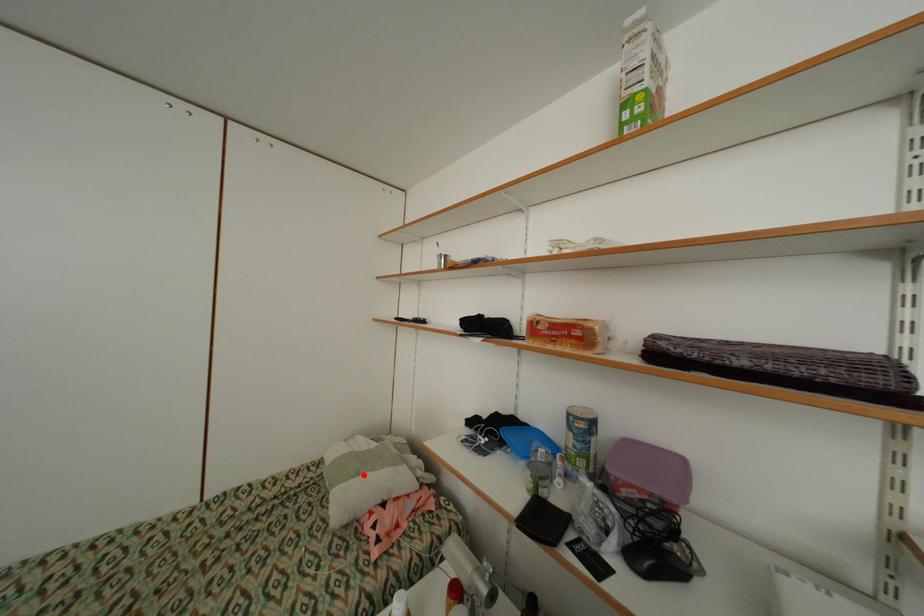
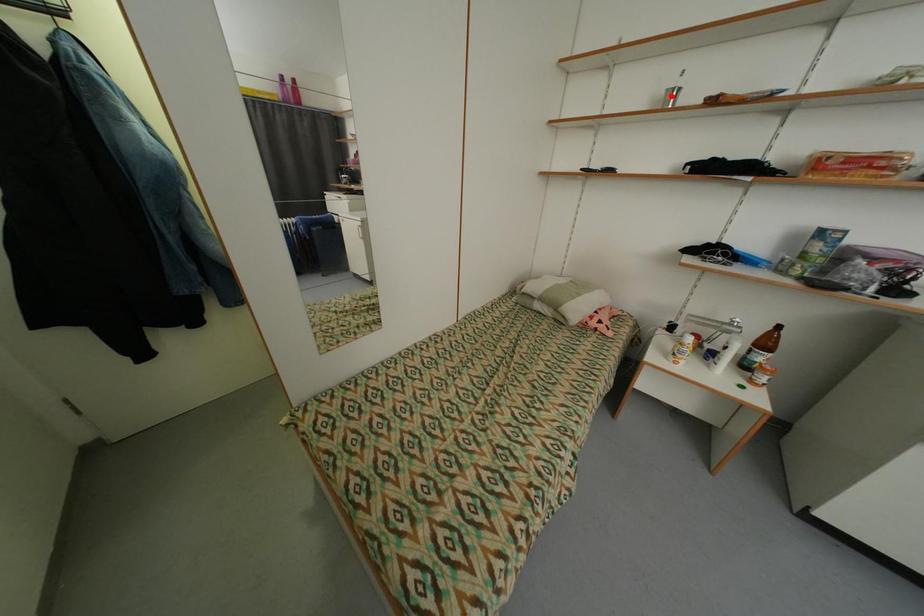
I am providing you with two images of the same scene from different viewpoints. A red point is marked on the first image and another point is marked on the second image. Is the marked point in image1 the same physical position as the marked point in image2?

No